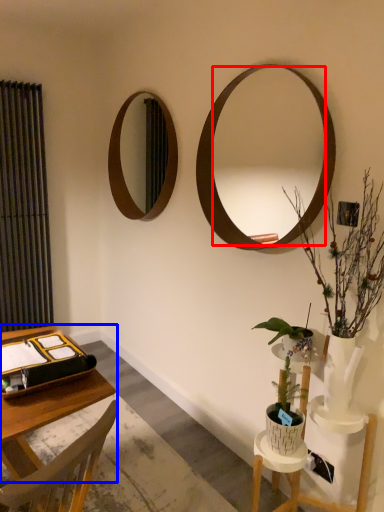
Question: Which point is further to the camera, mirror (highlighted by a red box) or vanity (highlighted by a blue box)?

Choices:
 (A) mirror
 (B) vanity

Answer: (A)